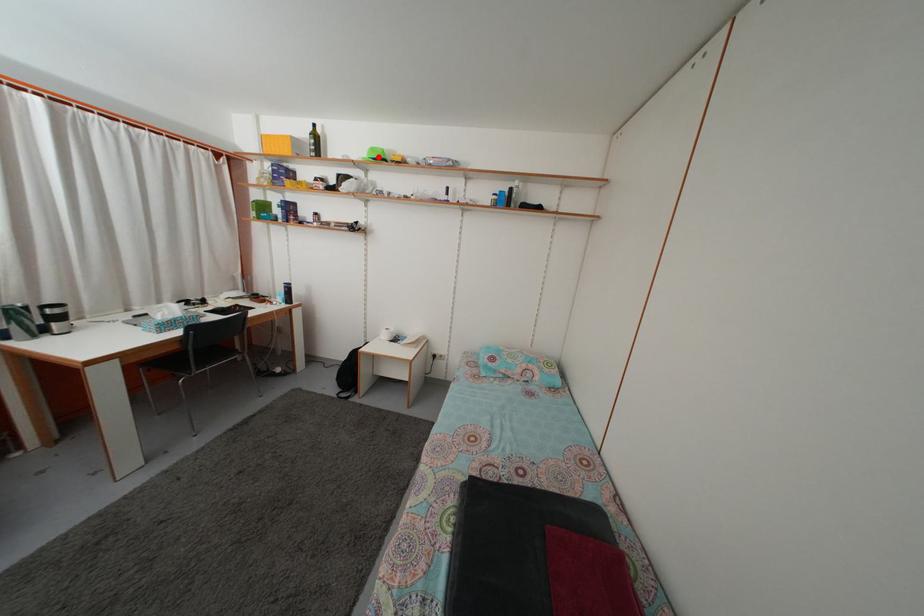
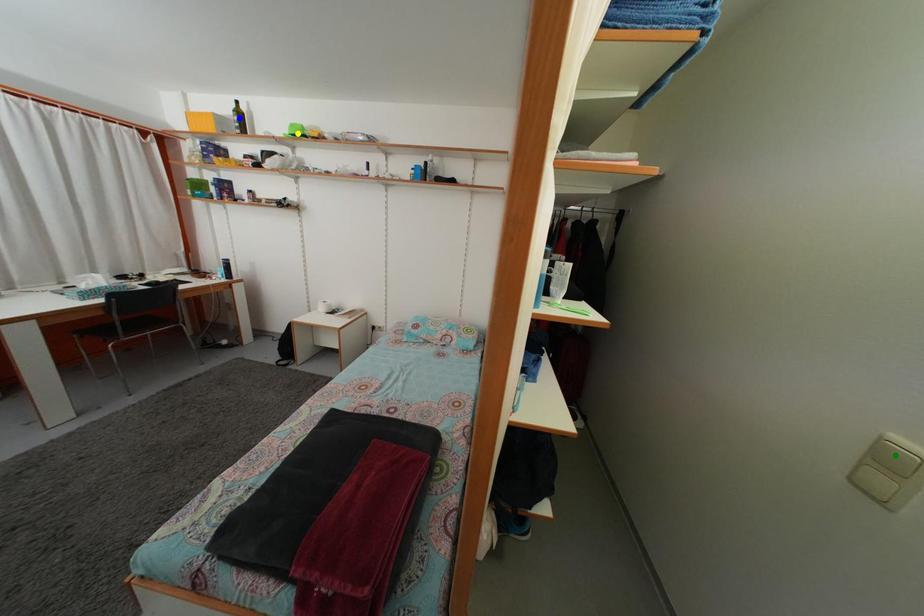
Question: I am providing you with two images of the same scene from different viewpoints. A red point is marked on the first image. You are given multiple points on the second image. Which point in image 2 represents the same 3d spot as the red point in image 1?

Choices:
 (A) yellow point
 (B) blue point
 (C) green point

Answer: (A)